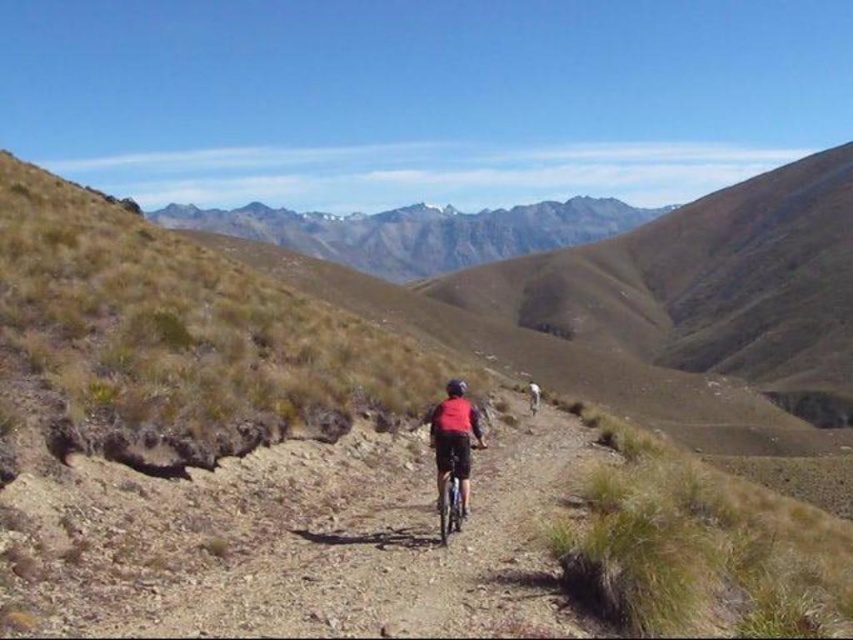
Question: Which of the following is the farthest from the observer?

Choices:
 (A) rugged granite mountains at center
 (B) red matte jacket at center

Answer: (A)

Question: Is rugged granite mountains at center to the right of red matte jacket at center from the viewer's perspective?

Choices:
 (A) yes
 (B) no

Answer: (B)

Question: Does rugged granite mountains at center appear under red matte jacket at center?

Choices:
 (A) no
 (B) yes

Answer: (A)

Question: Can you confirm if rugged granite mountains at center is thinner than red matte jacket at center?

Choices:
 (A) no
 (B) yes

Answer: (A)